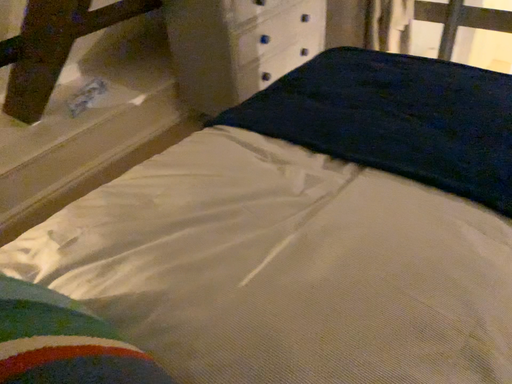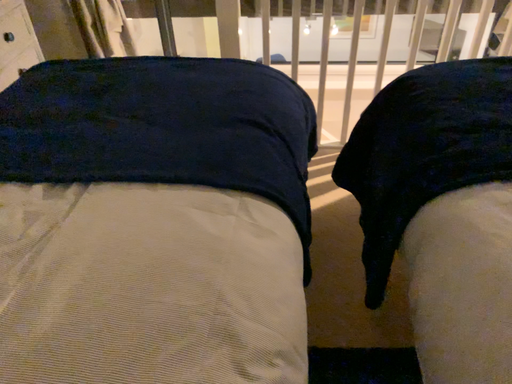
Question: Which way did the camera rotate in the video?

Choices:
 (A) rotated right
 (B) rotated left

Answer: (A)